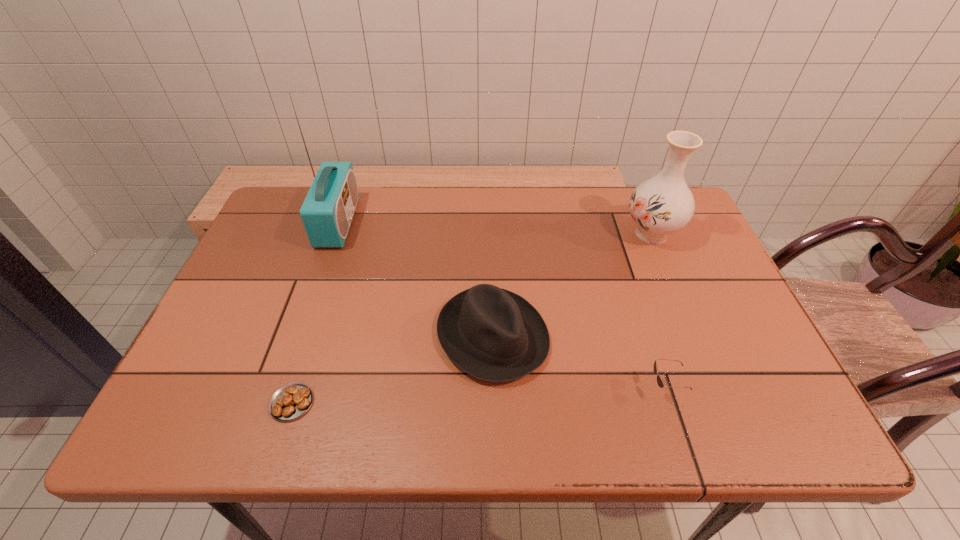
At what (x,y) coordinates should I click in order to perform the action: click on free space located 0.360m in front of the lenses of the sunglasses. Please return your answer as a coordinate pair (x, y). This screenshot has width=960, height=540. Looking at the image, I should click on (476, 388).

Find the location of a particular element. blank space located in front of the lenses of the sunglasses is located at coordinates (510, 388).

At what (x,y) coordinates should I click in order to perform the action: click on free space located on the left of the shortest object. Please return your answer as a coordinate pair (x, y). The image size is (960, 540). Looking at the image, I should click on (241, 402).

I want to click on radio receiver that is at the far edge, so point(327,212).

At what (x,y) coordinates should I click in order to perform the action: click on vase at the far edge. Please return your answer as a coordinate pair (x, y). This screenshot has width=960, height=540. Looking at the image, I should click on (663, 204).

Where is `sunglasses that is at the near edge`? The height and width of the screenshot is (540, 960). sunglasses that is at the near edge is located at coordinates (660, 382).

Locate an element on the screen. This screenshot has width=960, height=540. pastry present at the near edge is located at coordinates (291, 401).

Locate an element on the screen. object at the left edge is located at coordinates (327, 212).

Find the location of a particular element. This screenshot has height=540, width=960. object that is at the right edge is located at coordinates (663, 204).

Locate an element on the screen. The width and height of the screenshot is (960, 540). object that is positioned at the far left corner is located at coordinates (327, 212).